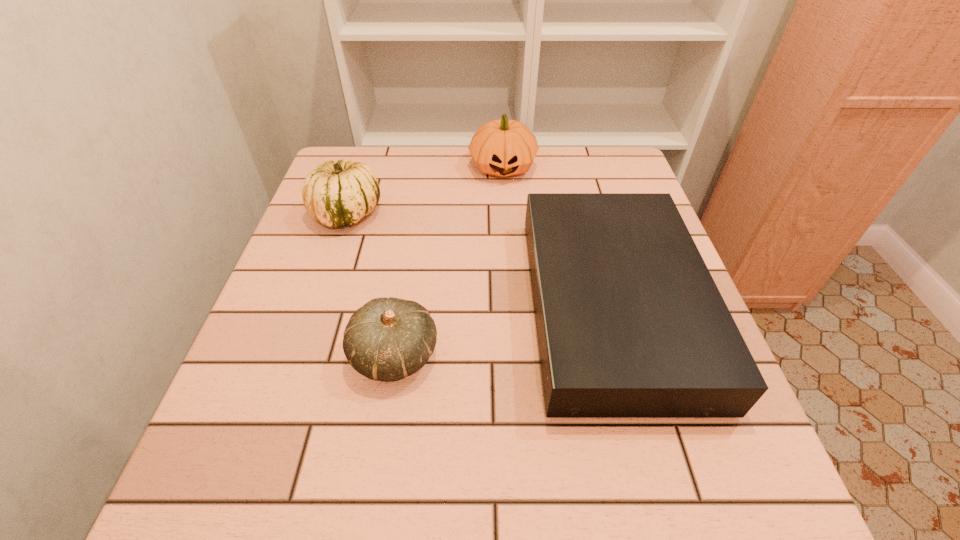
Locate an element on the screen. The width and height of the screenshot is (960, 540). vacant space at the near left corner is located at coordinates (300, 476).

The image size is (960, 540). I want to click on free space at the far right corner, so pyautogui.click(x=637, y=191).

The width and height of the screenshot is (960, 540). In the image, there is a desktop. What are the coordinates of `vacant region at the near right corner` in the screenshot? It's located at (670, 502).

Where is `free spot between the shortest gourd and the farthest object`? free spot between the shortest gourd and the farthest object is located at coordinates (448, 261).

Find the location of a particular element. free space between the second object from left to right and the CD player is located at coordinates (503, 330).

The height and width of the screenshot is (540, 960). I want to click on free spot between the shortest gourd and the leftmost gourd, so click(371, 284).

At what (x,y) coordinates should I click in order to perform the action: click on vacant region between the CD player and the nearest gourd. Please return your answer as a coordinate pair (x, y). This screenshot has height=540, width=960. Looking at the image, I should click on (503, 330).

I want to click on free space between the second farthest gourd and the second gourd from right to left, so click(x=371, y=284).

You are a GUI agent. You are given a task and a screenshot of the screen. Output one action in this format:
    pyautogui.click(x=<x>, y=<y>)
    Task: Click on the unoccupied position between the second gourd from left to right and the farthest object
    The height and width of the screenshot is (540, 960).
    Given the screenshot: What is the action you would take?
    pyautogui.click(x=448, y=261)

Where is `free space between the shortest object and the nearest gourd`? The width and height of the screenshot is (960, 540). free space between the shortest object and the nearest gourd is located at coordinates (503, 330).